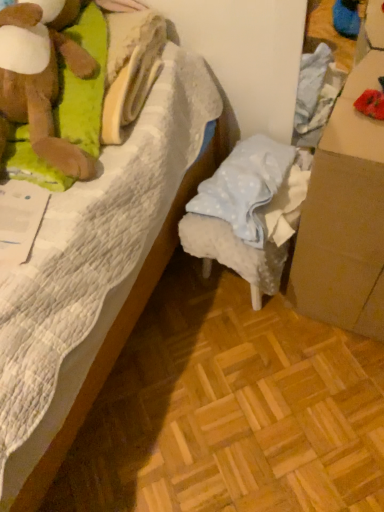
You are a GUI agent. You are given a task and a screenshot of the screen. Output one action in this format:
    pyautogui.click(x=<x>, y=<y>)
    Task: Click on the light blue fabric stool at center
    This screenshot has height=512, width=384.
    Given the screenshot: What is the action you would take?
    pyautogui.click(x=249, y=212)

Is light blue fabric stool at center facing towards white quilted bed at center?

Yes, light blue fabric stool at center is aimed at white quilted bed at center.

Based on the photo, is white quilted bed at center a part of light blue fabric stool at center?

No, white quilted bed at center is not inside light blue fabric stool at center.

From the image's perspective, is light blue fabric stool at center above or below white quilted bed at center?

Based on their image positions, light blue fabric stool at center is located above white quilted bed at center.

Between light blue fabric stool at center and white quilted bed at center, which one appears on the right side from the viewer's perspective?

Positioned to the right is light blue fabric stool at center.

Which is in front, white quilted bed at center or brown cardboard box at right?

white quilted bed at center is in front.

Is point (124, 278) closer to camera compared to point (357, 76)?

No.

Based on the photo, is white quilted bed at center situated inside brown cardboard box at right or outside?

white quilted bed at center exists outside the volume of brown cardboard box at right.

Would you say white quilted bed at center is to the left or to the right of brown cardboard box at right in the picture?

white quilted bed at center is to the left of brown cardboard box at right.

I want to click on bed that is above the brown cardboard box at right (from the image's perspective), so click(100, 270).

Is the surface of brown cardboard box at right in direct contact with white quilted bed at center?

brown cardboard box at right and white quilted bed at center are clearly separated.

Considering the points (330, 270) and (92, 391), which point is in front, point (330, 270) or point (92, 391)?

Point (92, 391)

From a real-world perspective, does brown cardboard box at right stand above white quilted bed at center?

No.

Is point (46, 375) positioned in front of point (239, 174)?

Yes, it is in front of point (239, 174).

Which object is positioned more to the right, white quilted bed at center or light blue fabric stool at center?

Positioned to the right is light blue fabric stool at center.

From a real-world perspective, which object rests below the other?

light blue fabric stool at center, from a real-world perspective.

Which of these two, white quilted bed at center or light blue fabric stool at center, is bigger?

With larger size is white quilted bed at center.

Is light blue fabric stool at center inside brown cardboard box at right?

No, light blue fabric stool at center is not inside brown cardboard box at right.

Is brown cardboard box at right to the left or to the right of light blue fabric stool at center in the image?

brown cardboard box at right is to the right of light blue fabric stool at center.

From the image's perspective, which is below, brown cardboard box at right or light blue fabric stool at center?

brown cardboard box at right, from the image's perspective.

Based on their sizes in the image, would you say brown cardboard box at right is bigger or smaller than light blue fabric stool at center?

In the image, brown cardboard box at right appears to be larger than light blue fabric stool at center.

Is light blue fabric stool at center thinner than brown cardboard box at right?

In fact, light blue fabric stool at center might be wider than brown cardboard box at right.

Is light blue fabric stool at center oriented away from brown cardboard box at right?

No, light blue fabric stool at center's orientation is not away from brown cardboard box at right.

Is light blue fabric stool at center inside or outside of brown cardboard box at right?

light blue fabric stool at center is not inside brown cardboard box at right, it's outside.

Can you tell me how much light blue fabric stool at center and brown cardboard box at right differ in facing direction?

The angle between the facing direction of light blue fabric stool at center and the facing direction of brown cardboard box at right is 6.19 degrees.

The width and height of the screenshot is (384, 512). I want to click on furniture located above the white quilted bed at center (from the image's perspective), so click(x=249, y=212).

Locate an element on the screen. This screenshot has width=384, height=512. cardboard box behind the white quilted bed at center is located at coordinates (345, 217).

Based on the photo, from the image, which object appears to be nearer to white quilted bed at center, light blue fabric stool at center or brown cardboard box at right?

light blue fabric stool at center lies closer to white quilted bed at center than the other object.

When comparing their distances from light blue fabric stool at center, does white quilted bed at center or brown cardboard box at right seem closer?

brown cardboard box at right lies closer to light blue fabric stool at center than the other object.

Estimate the real-world distances between objects in this image. Which object is further from brown cardboard box at right, light blue fabric stool at center or white quilted bed at center?

Based on the image, white quilted bed at center appears to be further to brown cardboard box at right.

Based on their spatial positions, is brown cardboard box at right or white quilted bed at center closer to light blue fabric stool at center?

brown cardboard box at right.

Looking at the image, which one is located further to brown cardboard box at right, white quilted bed at center or light blue fabric stool at center?

white quilted bed at center lies further to brown cardboard box at right than the other object.

Estimate the real-world distances between objects in this image. Which object is closer to white quilted bed at center, brown cardboard box at right or light blue fabric stool at center?

light blue fabric stool at center is positioned closer to the anchor white quilted bed at center.

Find the location of a particular element. furniture between white quilted bed at center and brown cardboard box at right from left to right is located at coordinates (249, 212).